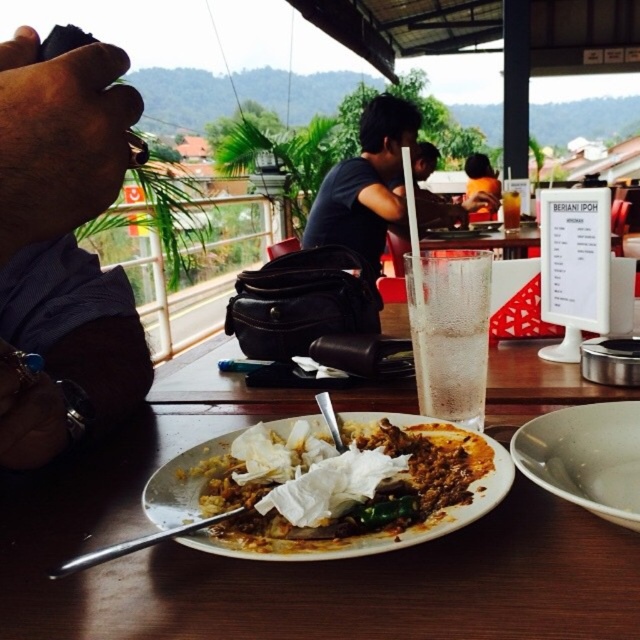
Question: Which point is closer to the camera?

Choices:
 (A) clear glass at center
 (B) white glossy plate at center

Answer: (B)

Question: Can you confirm if brown matte plate at center is positioned below white matte plate at center?

Choices:
 (A) yes
 (B) no

Answer: (A)

Question: Among these objects, which one is farthest from the camera?

Choices:
 (A) white matte plate at center
 (B) matte black bag at center
 (C) clear glass at center

Answer: (B)

Question: Does white matte plate at center have a greater width compared to matte black bag at center?

Choices:
 (A) no
 (B) yes

Answer: (A)

Question: Does brown matte plate at center have a greater width compared to white matte plate at center?

Choices:
 (A) yes
 (B) no

Answer: (A)

Question: Which object is closer to the camera taking this photo?

Choices:
 (A) brown matte plate at center
 (B) matte black bag at center
 (C) dark skin tone hand at left

Answer: (C)